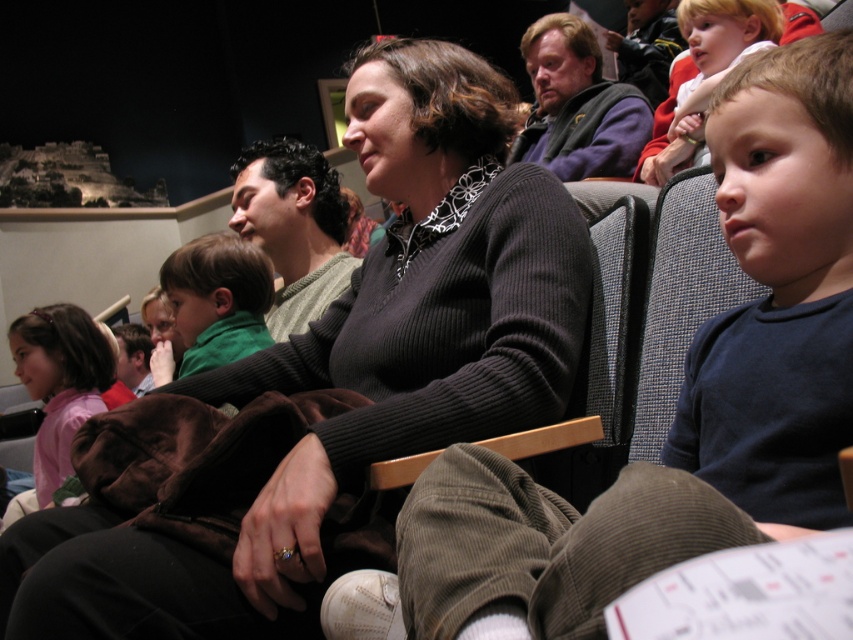
You are organizing a clothing donation drive and need to categorize items by size. You have two items to sort today. The first is a dark blue cotton shirt at right, and the second is a green sweater at center. Which of these two items is narrower in width?

The dark blue cotton shirt at right is thinner than the green sweater at center, so the dark blue cotton shirt at right is narrower in width.

Based on the scene description, which object is taller between the black ribbed sweater at center and the pink fabric shirt at lower left?

The black ribbed sweater at center is taller than the pink fabric shirt at lower left.

Based on the photo, you are sitting in the auditorium and want to hand a note to the person wearing the dark blue cotton shirt at right without disturbing the person in the green sweater at center. How can you do this?

Since the dark blue cotton shirt at right is located below the green sweater at center, you can slide the note underneath the green sweater at center to reach the dark blue cotton shirt at right without disturbing them.